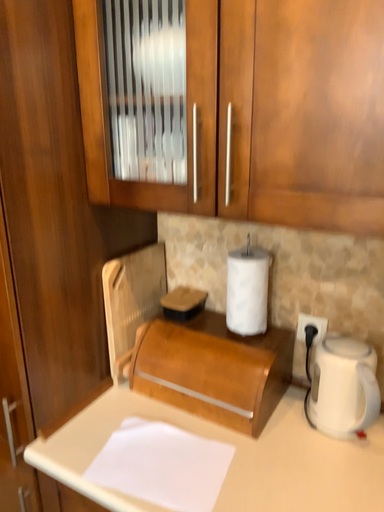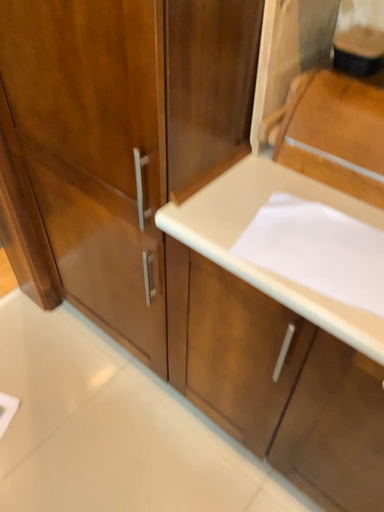
Question: How did the camera likely rotate when shooting the video?

Choices:
 (A) rotated upward
 (B) rotated downward

Answer: (B)